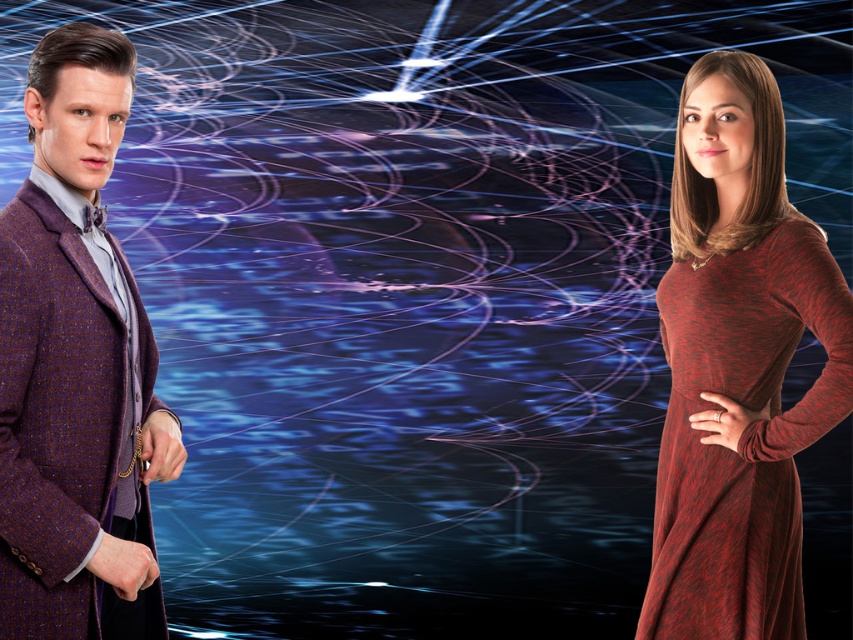
Is plush wool coat at left smaller than maroon knit dress at right?

Yes.

Is point (90, 600) more distant than point (753, 579)?

No, (90, 600) is closer to viewer.

Which is behind, point (119, 292) or point (657, 576)?

The point (657, 576) is more distant.

Where is `plush wool coat at left`? plush wool coat at left is located at coordinates (76, 368).